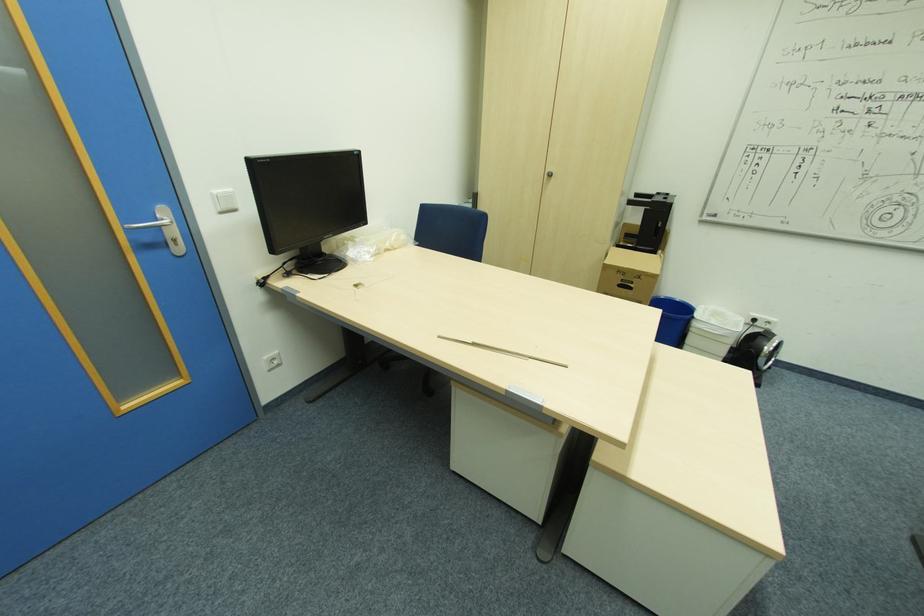
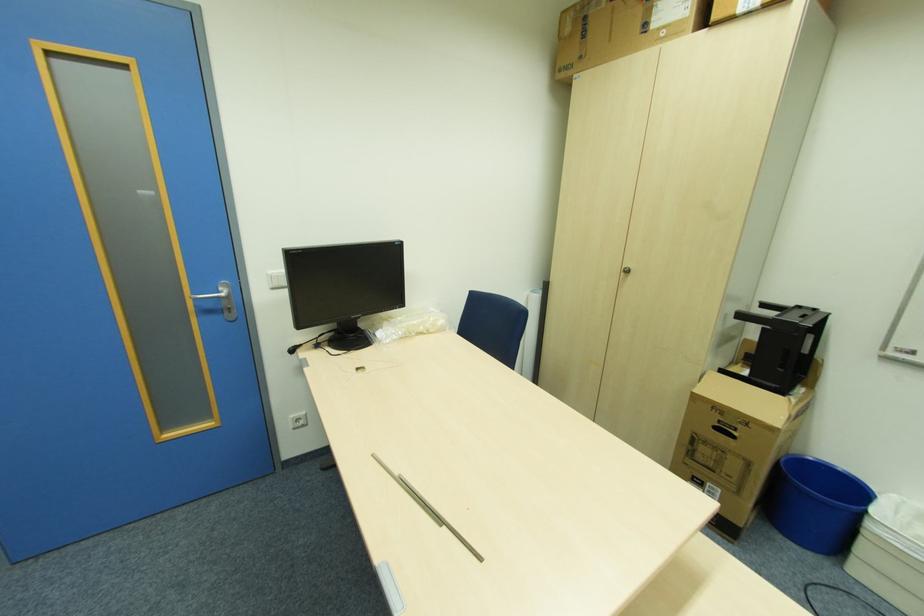
In the second image, find the point that corresponds to (x=704, y=306) in the first image.

(896, 496)